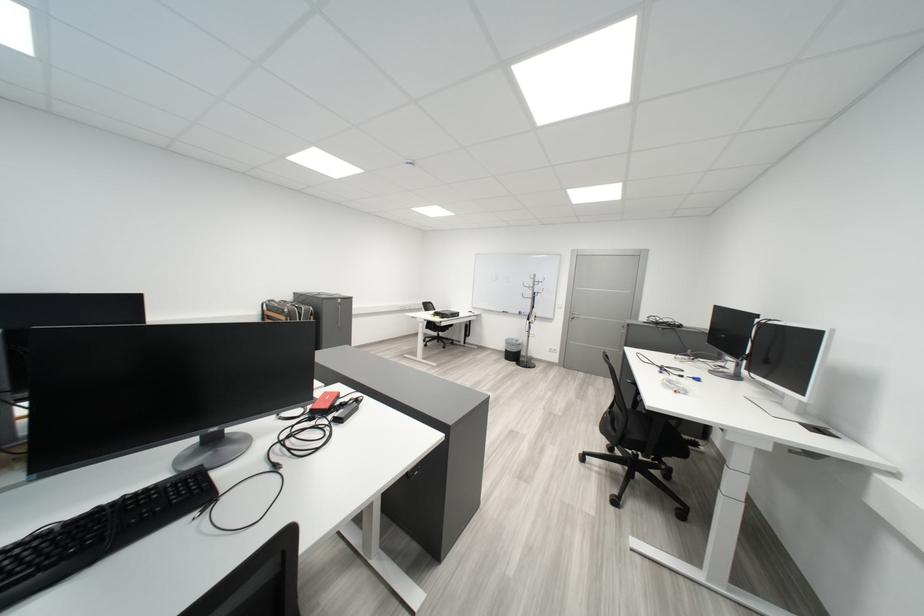
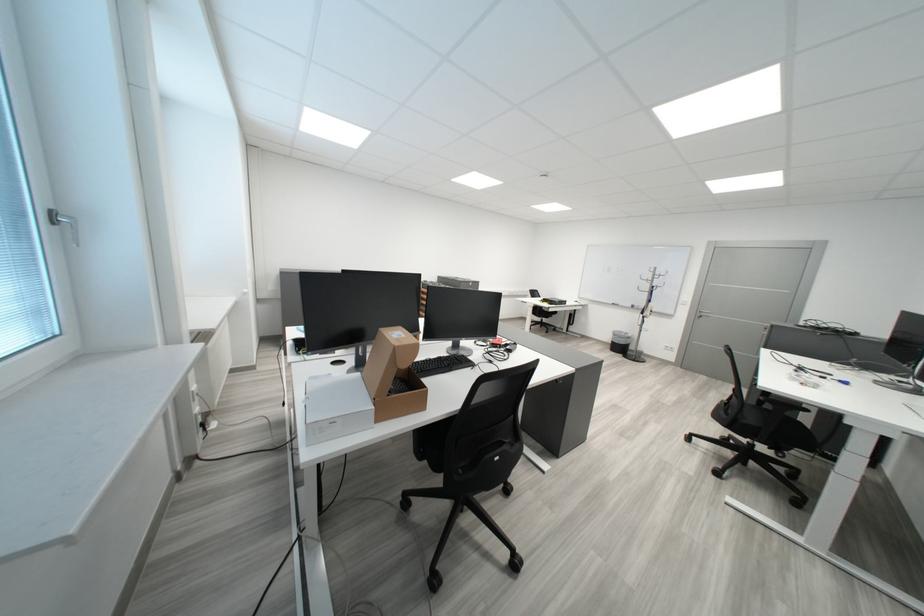
Find the pixel in the second image that matches [110,514] in the first image.

(453, 360)